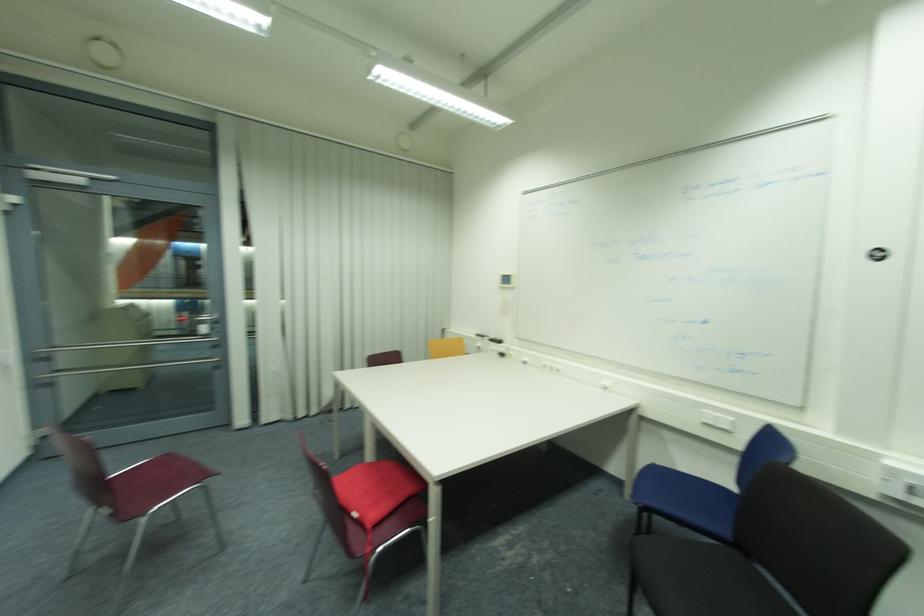
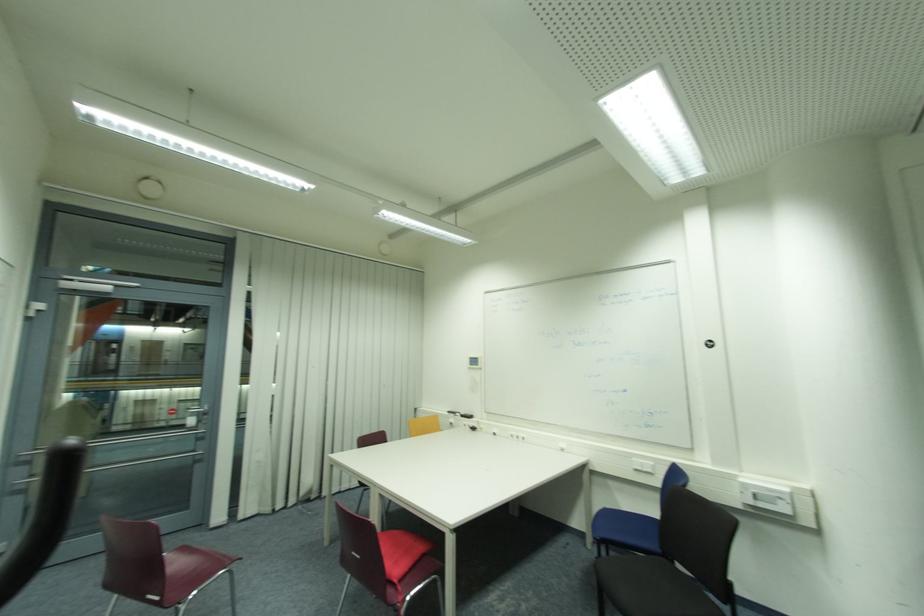
The images are taken continuously from a first-person perspective. In which direction are you moving?

The cameraman moved toward left, backward.